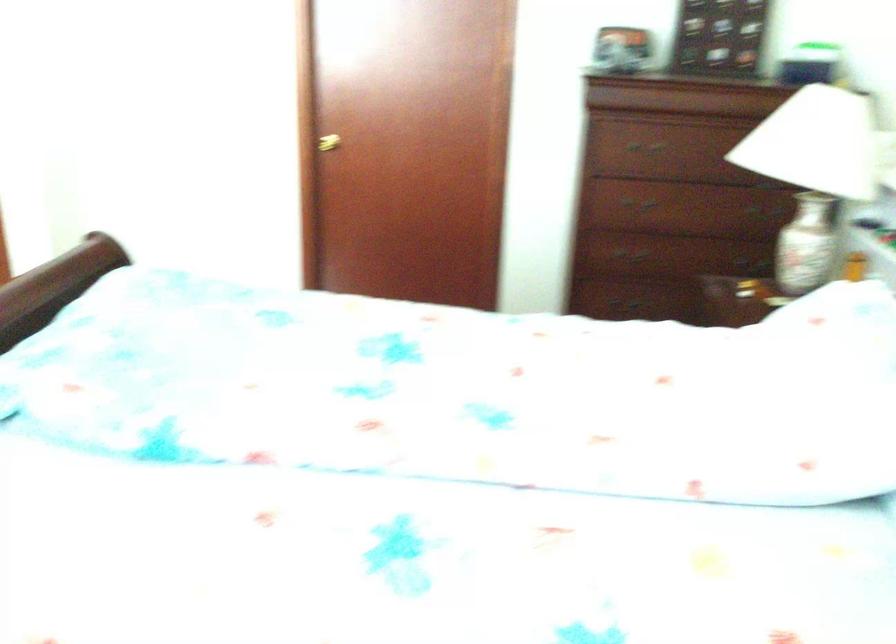
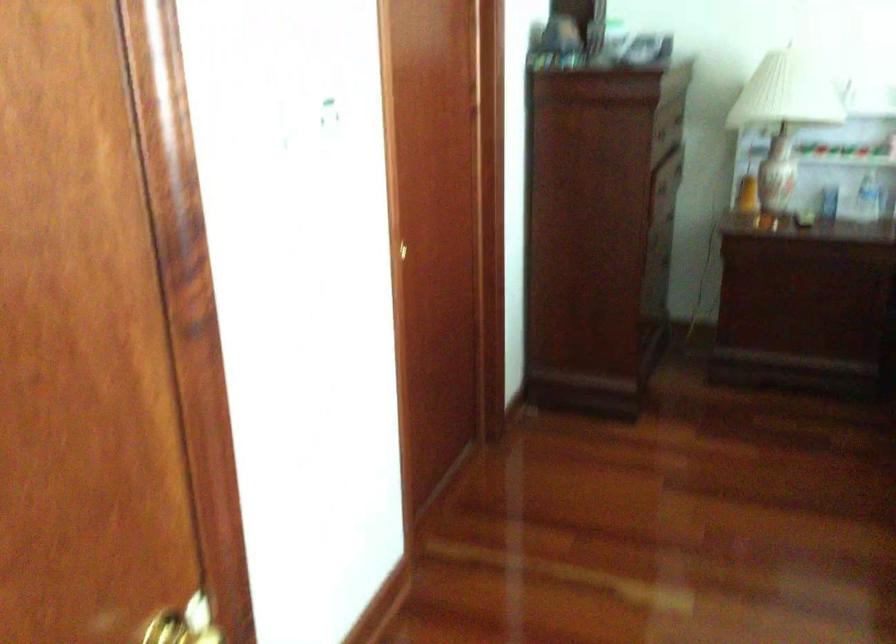
The point at (x=391, y=158) is marked in the first image. Where is the corresponding point in the second image?

(408, 250)